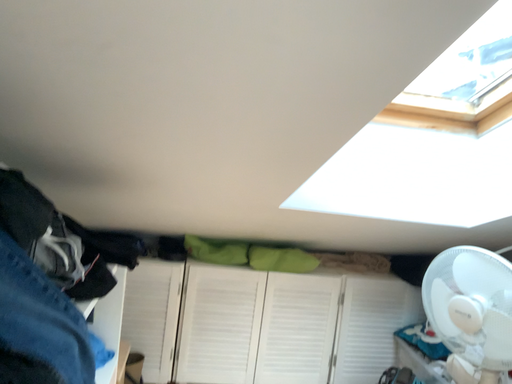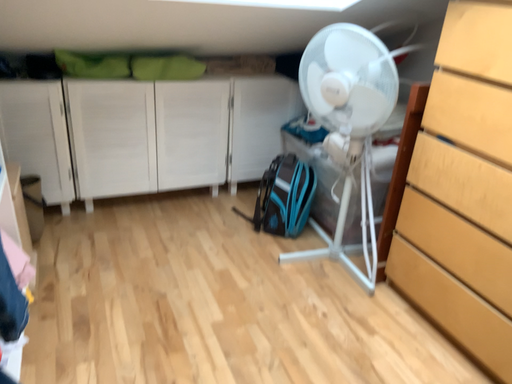
Question: Which way did the camera rotate in the video?

Choices:
 (A) rotated upward
 (B) rotated downward

Answer: (B)